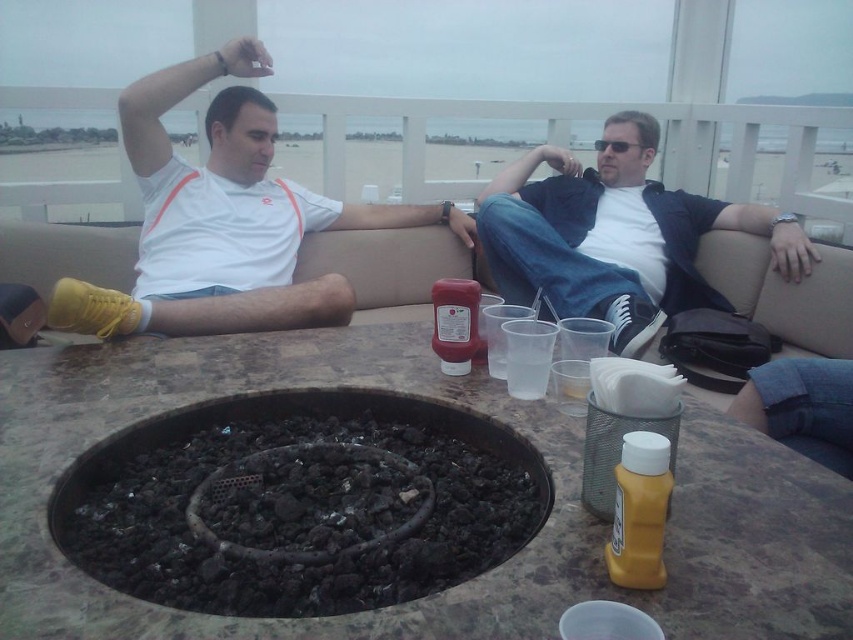
Does marble table at center appear over white matte shirt at upper left?

No.

The image size is (853, 640). What do you see at coordinates (459, 584) in the screenshot?
I see `marble table at center` at bounding box center [459, 584].

Between point (581, 518) and point (189, 264), which one is positioned in front?

Positioned in front is point (581, 518).

Where is `marble table at center`? The height and width of the screenshot is (640, 853). marble table at center is located at coordinates (459, 584).

Is point (49, 376) less distant than point (444, 548)?

No, (49, 376) is behind (444, 548).

Is marble table at center positioned behind charcoal ash fire pit at center?

No.

Where is `marble table at center`? marble table at center is located at coordinates (459, 584).

Can you confirm if charcoal ash fire pit at center is taller than matte black jacket at center?

Incorrect, charcoal ash fire pit at center's height is not larger of matte black jacket at center's.

Which is in front, point (181, 461) or point (495, 184)?

Point (181, 461) is in front.

The width and height of the screenshot is (853, 640). Find the location of `charcoal ash fire pit at center`. charcoal ash fire pit at center is located at coordinates (300, 502).